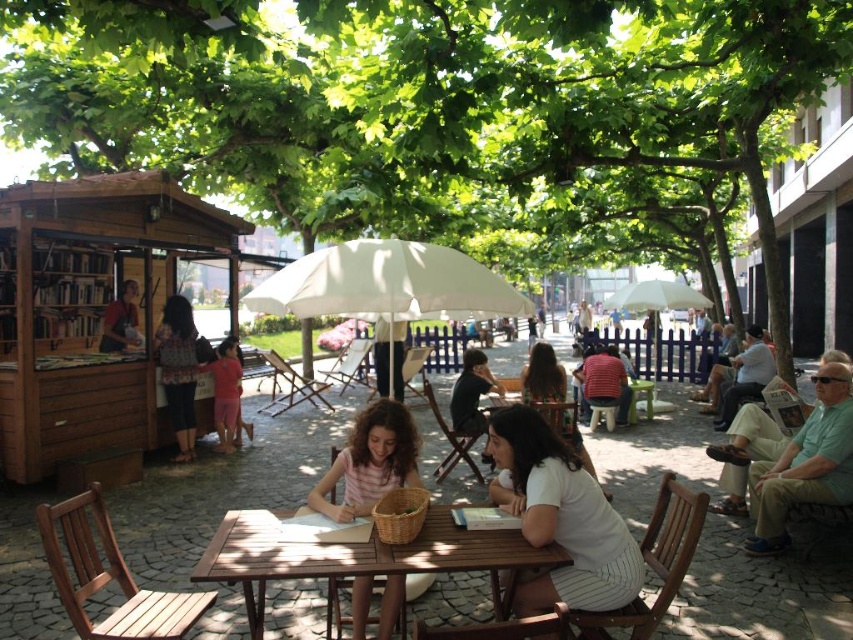
You are standing in the park and see two points in the image. Which point is closer to you, point (546, 364) or point (213, 401)?

Point (546, 364) is closer to the viewer than point (213, 401).

You are standing in the public square and want to place a small potted plant on the brown wooden table at center. The potted plant has coordinates of point [357,556]. Is this point on the table?

Yes, the point [357,556] is on the brown wooden table at center, so the potted plant can be placed there.

You are standing in the park and want to take a photo of both the light brown hair at center and the pink fabric dress at center. Which object should you focus on first to ensure both are in clear view?

You should focus on the light brown hair at center first since it is closer to the viewer than the pink fabric dress at center, ensuring both will be in clear view when focused properly.